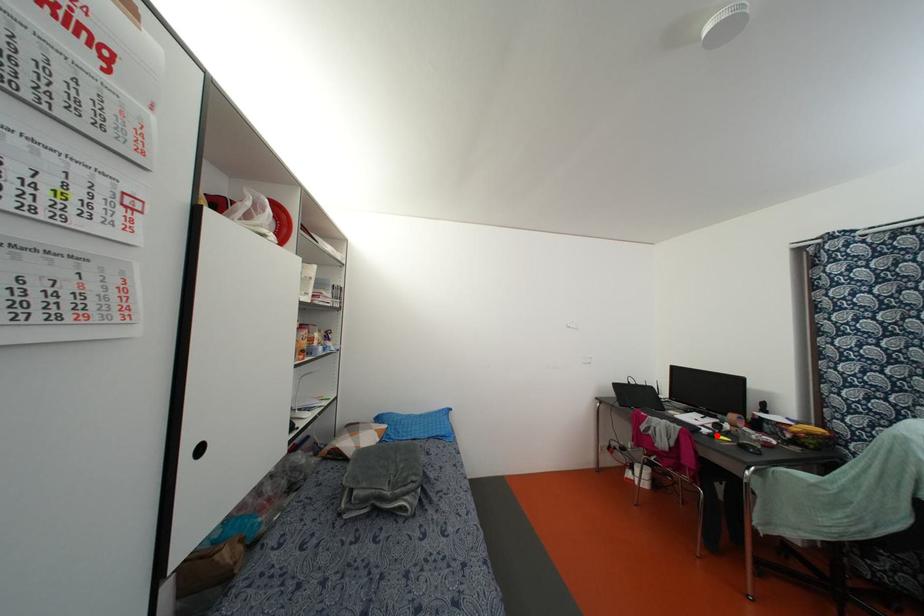
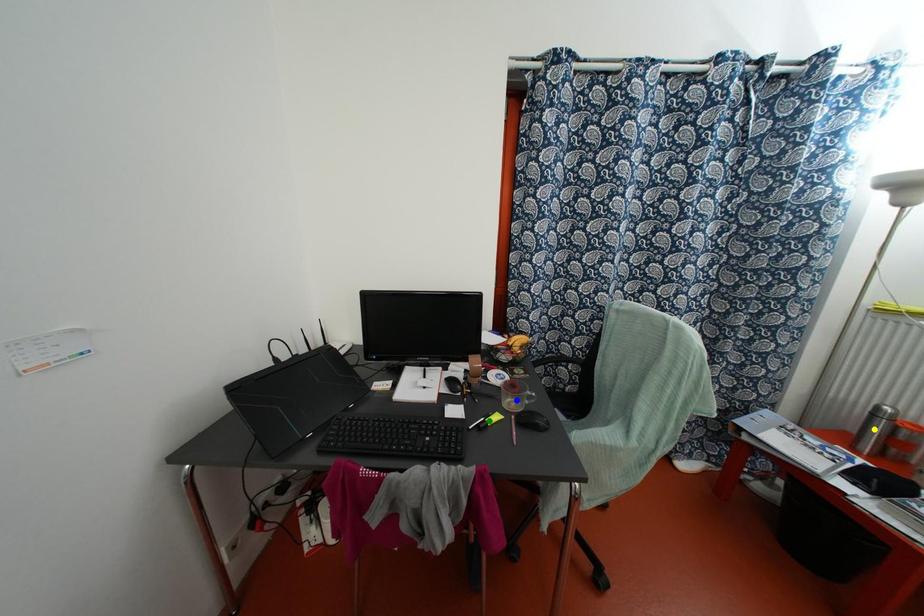
Question: I am providing you with two images of the same scene from different viewpoints. A red point is marked on the first image. You are given multiple points on the second image. Which spot in image 2 lines up with the point in image 1?

Choices:
 (A) blue point
 (B) green point
 (C) yellow point

Answer: (B)